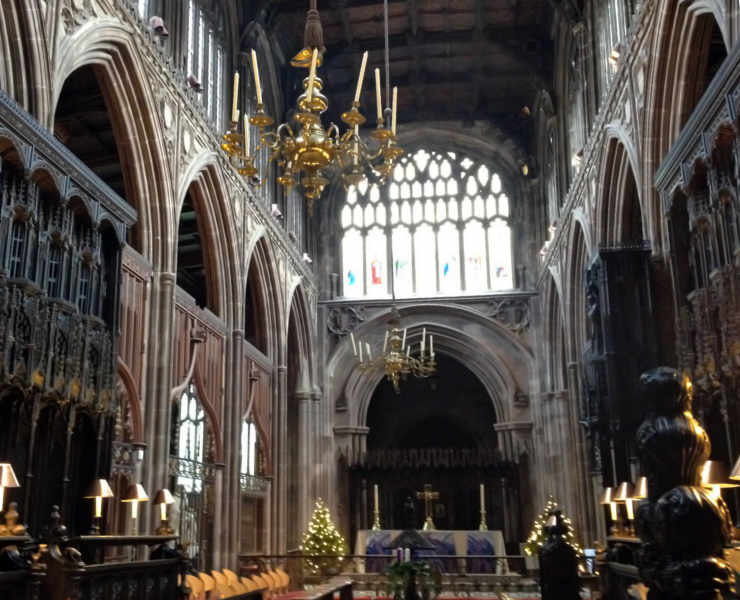
The width and height of the screenshot is (740, 600). What are the coordinates of `lights` in the screenshot? It's located at (3, 471), (98, 495), (135, 498), (164, 497), (735, 473), (709, 473), (636, 487), (616, 497), (605, 500).